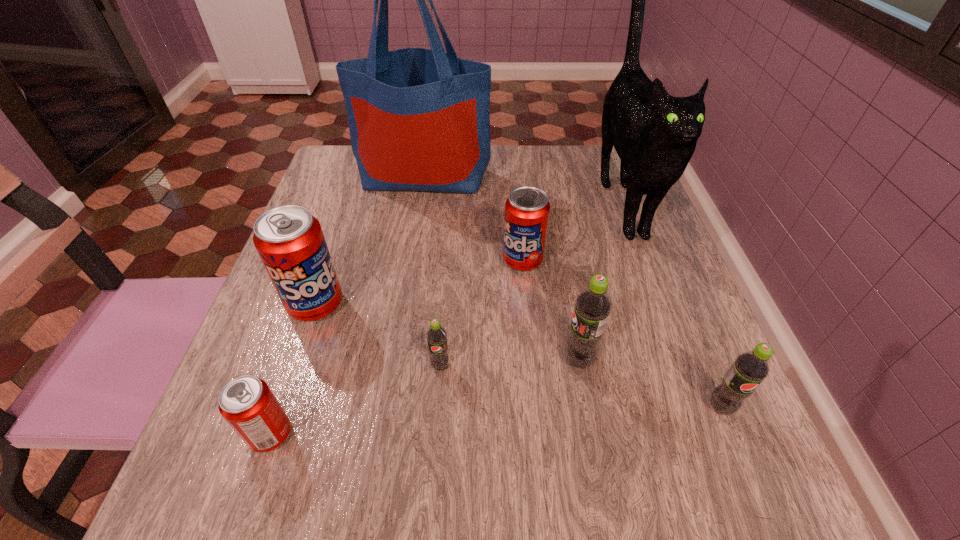
Where is `object at the near left corner`? object at the near left corner is located at coordinates (247, 403).

Image resolution: width=960 pixels, height=540 pixels. I want to click on object that is at the far right corner, so click(654, 134).

The image size is (960, 540). In order to click on free space at the far edge of the desktop in this screenshot , I will do `click(534, 180)`.

Find the location of a particular element. This screenshot has width=960, height=540. free space at the near edge of the desktop is located at coordinates (369, 498).

Locate an element on the screen. The height and width of the screenshot is (540, 960). free spot at the left edge of the desktop is located at coordinates (256, 340).

The height and width of the screenshot is (540, 960). In the image, there is a desktop. What are the coordinates of `vacant space at the right edge` in the screenshot? It's located at (717, 375).

Where is `vacant space at the far left corner of the desktop`? vacant space at the far left corner of the desktop is located at coordinates [334, 187].

Identify the location of vacant space at the near left corner. (271, 515).

Image resolution: width=960 pixels, height=540 pixels. In the image, there is a desktop. What are the coordinates of `free space at the near right corner` in the screenshot? It's located at (680, 462).

Locate an element on the screen. This screenshot has height=540, width=960. free space that is in between the nearest red soda can and the rightmost green soda is located at coordinates (495, 421).